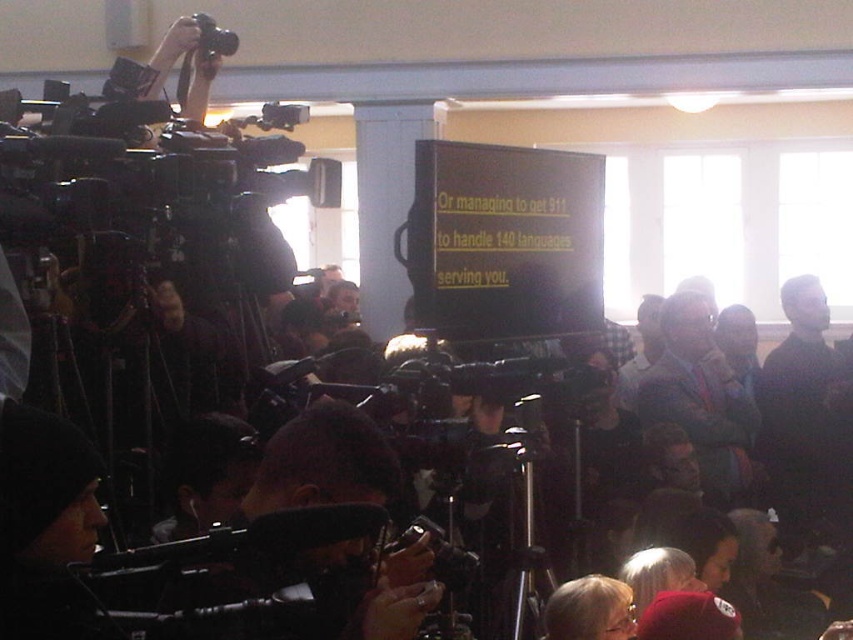
You are a photographer at the event and need to capture a clear shot of the blonde hair at lower center without the black plastic video camera at upper left blocking the view. Which direction should you move to achieve this?

The blonde hair at lower center is to the right of the black plastic video camera at upper left. To avoid the camera blocking the view, you should move to the right side of the black plastic video camera at upper left so that the blonde hair at lower center becomes visible without obstruction.

From the picture: You are a photographer at the event and want to capture a clear shot of the blue fabric suit at center without the black plastic video camera at upper left blocking the view. Is the camera positioned in a way that it might obstruct your shot?

The blue fabric suit at center is located below the black plastic video camera at upper left, so the camera is positioned above the suit. This means the black plastic video camera at upper left may block the upper part of the shot, but since it is above, you might still capture the suit clearly by adjusting the angle slightly downward.

You are a photographer at the event and need to position yourself so that both point (x=550, y=632) and point (x=202, y=33) are visible in your shot. Given their positions, which point should you prioritize framing closer to the camera to ensure both are in the frame?

You should prioritize framing point (x=202, y=33) closer to the camera because point (x=550, y=632) is in front of point (x=202, y=33), meaning it is already closer and more visible. By positioning the camera to focus on the farther point, both points will remain in the frame without one being obscured.